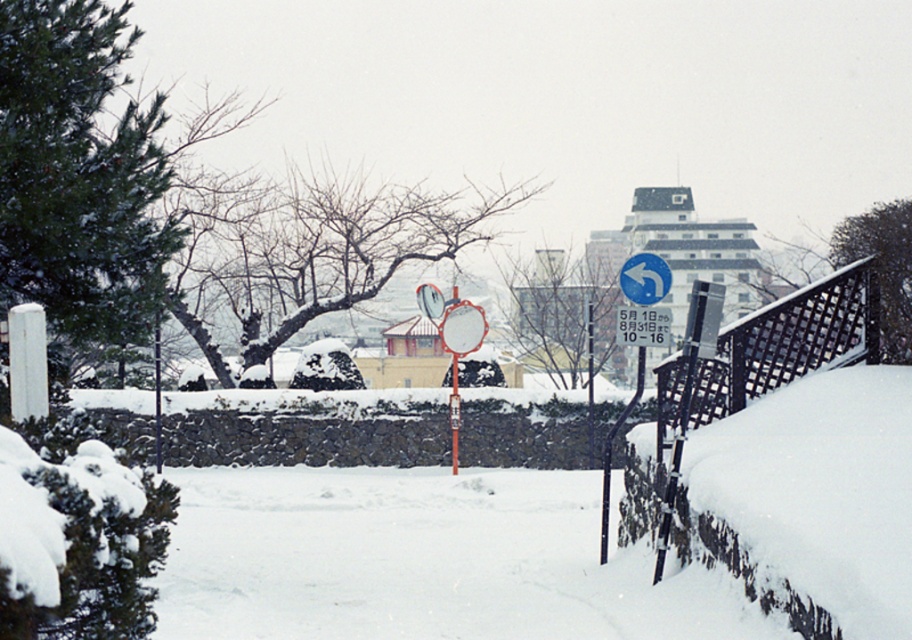
Question: Can you confirm if blue circular sign at upper right is positioned below blue plastic sign at upper center?

Choices:
 (A) yes
 (B) no

Answer: (B)

Question: Can you confirm if blue circular sign at upper right is wider than blue plastic sign at upper center?

Choices:
 (A) yes
 (B) no

Answer: (B)

Question: Can you confirm if blue circular sign at upper right is smaller than blue plastic sign at upper center?

Choices:
 (A) yes
 (B) no

Answer: (B)

Question: Which point is farther to the camera?

Choices:
 (A) (644, 300)
 (B) (638, 320)

Answer: (A)